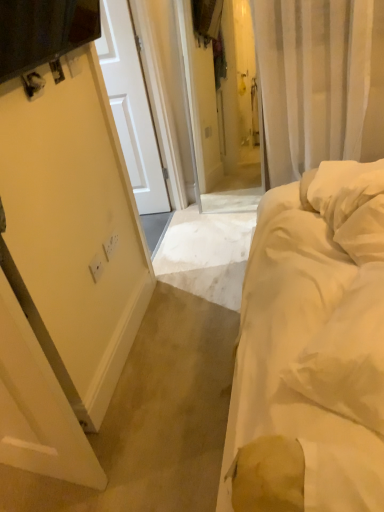
Find the location of a particular element. Image resolution: width=384 pixels, height=512 pixels. white plastic electric outlet at left is located at coordinates (110, 246).

Describe the element at coordinates (110, 246) in the screenshot. This screenshot has width=384, height=512. I see `white plastic electric outlet at left` at that location.

Measure the distance between white soft bed at right and camera.

21.53 inches.

This screenshot has width=384, height=512. I want to click on white soft bed at right, so click(311, 349).

The width and height of the screenshot is (384, 512). Describe the element at coordinates (311, 349) in the screenshot. I see `white soft bed at right` at that location.

In order to click on white plastic electric outlet at left in this screenshot , I will do `click(110, 246)`.

Visually, is white soft bed at right positioned to the left or to the right of white plastic electric outlet at left?

white soft bed at right is to the right of white plastic electric outlet at left.

Who is more distant, white soft bed at right or white plastic electric outlet at left?

white plastic electric outlet at left is further away from the camera.

Between point (311, 185) and point (114, 243), which one is positioned behind?

The point (114, 243) is farther from the camera.

From the image's perspective, is white soft bed at right above white plastic electric outlet at left?

No, from the image's perspective, white soft bed at right is not over white plastic electric outlet at left.

From a real-world perspective, relative to white plastic electric outlet at left, is white soft bed at right vertically above or below?

Clearly, from a real-world perspective, white soft bed at right is below white plastic electric outlet at left.

In terms of width, does white soft bed at right look wider or thinner when compared to white plastic electric outlet at left?

Considering their sizes, white soft bed at right looks broader than white plastic electric outlet at left.

Who is shorter, white soft bed at right or white plastic electric outlet at left?

Standing shorter between the two is white plastic electric outlet at left.

Considering the relative sizes of white soft bed at right and white plastic electric outlet at left in the image provided, is white soft bed at right bigger than white plastic electric outlet at left?

Yes, white soft bed at right is bigger than white plastic electric outlet at left.

Is white soft bed at right situated inside white plastic electric outlet at left or outside?

white soft bed at right is spatially situated outside white plastic electric outlet at left.

Is the surface of white soft bed at right in direct contact with white plastic electric outlet at left?

There is a gap between white soft bed at right and white plastic electric outlet at left.

Is white soft bed at right oriented towards white plastic electric outlet at left?

Yes, white soft bed at right is oriented towards white plastic electric outlet at left.

How different are the orientations of white soft bed at right and white plastic electric outlet at left in degrees?

The facing directions of white soft bed at right and white plastic electric outlet at left are 178 degrees apart.

Where is `bed lying below the white plastic electric outlet at left (from the image's perspective)`? bed lying below the white plastic electric outlet at left (from the image's perspective) is located at coordinates tap(311, 349).

Between white plastic electric outlet at left and white soft bed at right, which one appears on the left side from the viewer's perspective?

Positioned to the left is white plastic electric outlet at left.

Who is more distant, white plastic electric outlet at left or white soft bed at right?

white plastic electric outlet at left is more distant.

Is point (109, 256) farther from camera compared to point (295, 244)?

Yes, point (109, 256) is farther from viewer.

From the image's perspective, would you say white plastic electric outlet at left is shown under white soft bed at right?

Actually, white plastic electric outlet at left appears above white soft bed at right in the image.

From a real-world perspective, which object rests below the other?

In real-world perspective, white soft bed at right is lower.

Considering the sizes of white plastic electric outlet at left and white soft bed at right in the image, is white plastic electric outlet at left wider or thinner than white soft bed at right?

white plastic electric outlet at left is thinner than white soft bed at right.

Can you confirm if white plastic electric outlet at left is shorter than white soft bed at right?

Correct, white plastic electric outlet at left is not as tall as white soft bed at right.

Is white plastic electric outlet at left bigger than white soft bed at right?

No.

Do you think white plastic electric outlet at left is within white soft bed at right, or outside of it?

white plastic electric outlet at left exists outside the volume of white soft bed at right.

Is white plastic electric outlet at left next to white soft bed at right and touching it?

white plastic electric outlet at left and white soft bed at right are not in contact.

Does white plastic electric outlet at left turn towards white soft bed at right?

Yes, white plastic electric outlet at left is turned towards white soft bed at right.

How much distance is there between white plastic electric outlet at left and white soft bed at right?

white plastic electric outlet at left is 36.21 inches away from white soft bed at right.

This screenshot has height=512, width=384. What are the coordinates of `electric outlet located above the white soft bed at right (from a real-world perspective)` in the screenshot? It's located at (110, 246).

In the image, there is a white plastic electric outlet at left. Where is `bed below it (from the image's perspective)`? The image size is (384, 512). bed below it (from the image's perspective) is located at coordinates (311, 349).

Find the location of a particular element. The width and height of the screenshot is (384, 512). electric outlet that is behind the white soft bed at right is located at coordinates (110, 246).